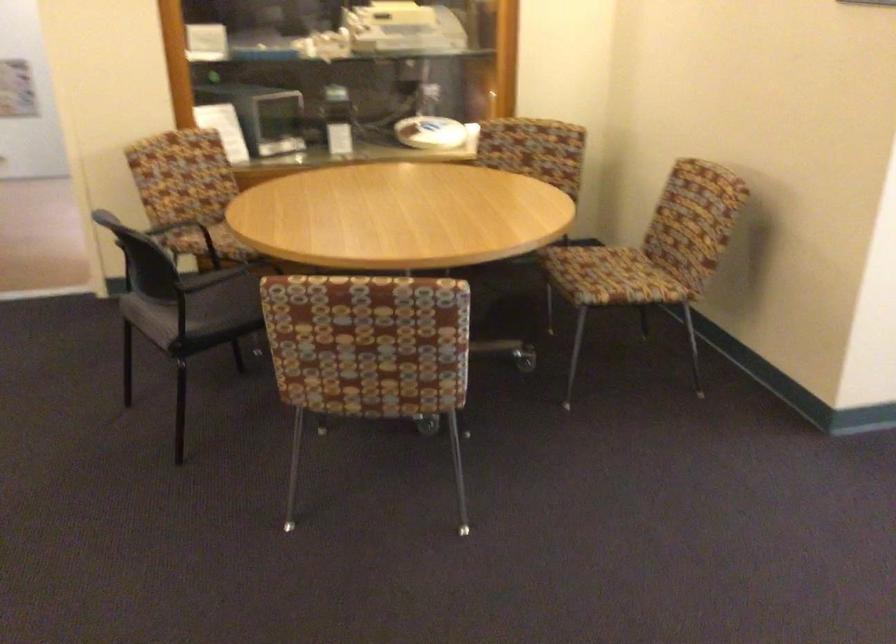
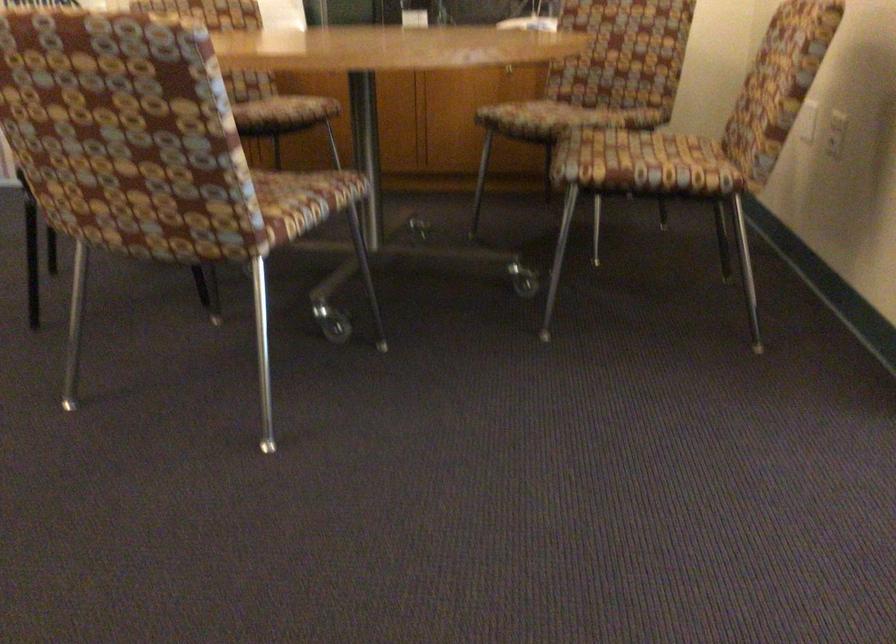
Find the pixel in the second image that matches (x=452, y=359) in the first image.

(289, 204)